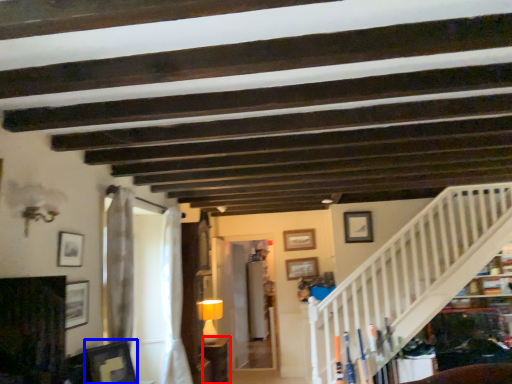
Question: Which object appears farthest to the camera in this image, furniture (highlighted by a red box) or picture frame (highlighted by a blue box)?

Choices:
 (A) furniture
 (B) picture frame

Answer: (A)